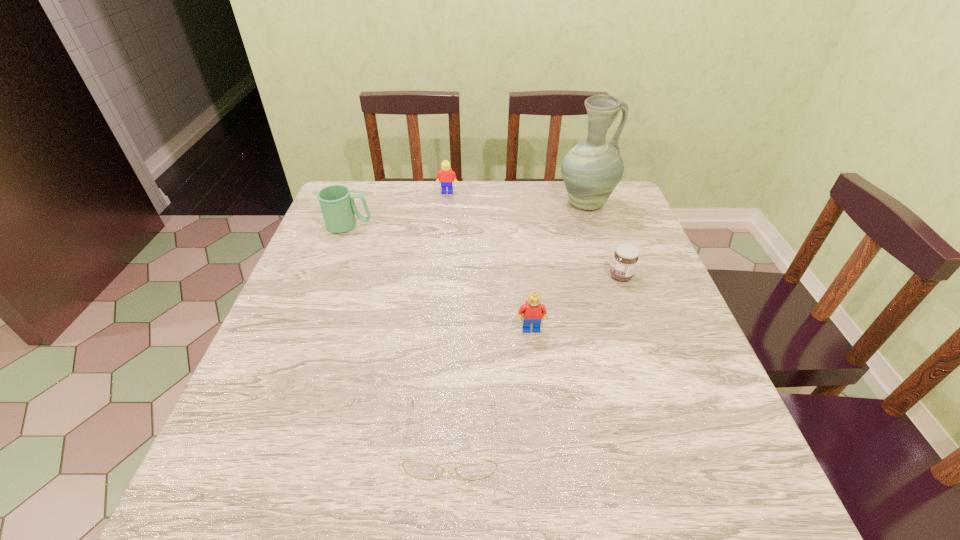
Where is `free point that satisfies the following two spatial constraints: 1. on the front label of the fifth tallest object; 2. on the face of the third object from right to left`? free point that satisfies the following two spatial constraints: 1. on the front label of the fifth tallest object; 2. on the face of the third object from right to left is located at coordinates (639, 329).